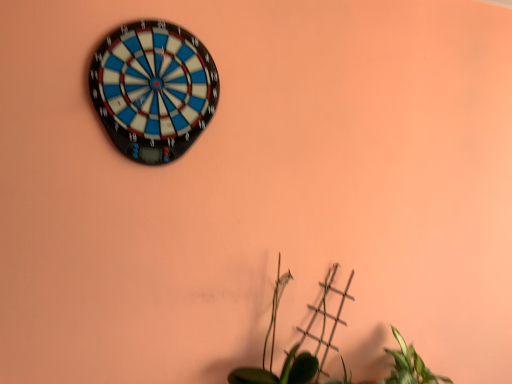
Describe the element at coordinates (153, 89) in the screenshot. I see `blue plastic dartboard at upper left` at that location.

The height and width of the screenshot is (384, 512). Identify the location of blue plastic dartboard at upper left. (153, 89).

The image size is (512, 384). Find the location of `green matte plant at lower center`. green matte plant at lower center is located at coordinates (298, 342).

Describe the element at coordinates (298, 342) in the screenshot. I see `green matte plant at lower center` at that location.

Measure the distance between green matte plant at lower center and camera.

1.32 meters.

The image size is (512, 384). Find the location of `blue plastic dartboard at upper left`. blue plastic dartboard at upper left is located at coordinates (153, 89).

Which object is positioned more to the left, green matte plant at lower center or blue plastic dartboard at upper left?

From the viewer's perspective, blue plastic dartboard at upper left appears more on the left side.

Considering the relative positions of green matte plant at lower center and blue plastic dartboard at upper left in the image provided, is green matte plant at lower center in front of blue plastic dartboard at upper left?

Yes, it is in front of blue plastic dartboard at upper left.

Considering the points (333, 335) and (169, 143), which point is in front, point (333, 335) or point (169, 143)?

Point (169, 143)

From the image's perspective, is green matte plant at lower center on top of blue plastic dartboard at upper left?

Incorrect, from the image's perspective, green matte plant at lower center is lower than blue plastic dartboard at upper left.

From a real-world perspective, relative to blue plastic dartboard at upper left, is green matte plant at lower center vertically above or below?

green matte plant at lower center is below blue plastic dartboard at upper left.

Which object is wider, green matte plant at lower center or blue plastic dartboard at upper left?

green matte plant at lower center is wider.

Considering the sizes of objects green matte plant at lower center and blue plastic dartboard at upper left in the image provided, who is taller, green matte plant at lower center or blue plastic dartboard at upper left?

Standing taller between the two is blue plastic dartboard at upper left.

Considering the sizes of objects green matte plant at lower center and blue plastic dartboard at upper left in the image provided, who is smaller, green matte plant at lower center or blue plastic dartboard at upper left?

Smaller between the two is blue plastic dartboard at upper left.

Choose the correct answer: Is green matte plant at lower center inside blue plastic dartboard at upper left or outside it?

green matte plant at lower center is not enclosed by blue plastic dartboard at upper left.

Is green matte plant at lower center not near blue plastic dartboard at upper left?

No, green matte plant at lower center is not far from blue plastic dartboard at upper left.

Is green matte plant at lower center turned away from blue plastic dartboard at upper left?

That's not correct — green matte plant at lower center is not looking away from blue plastic dartboard at upper left.

Can you tell me how much green matte plant at lower center and blue plastic dartboard at upper left differ in facing direction?

There is a 0.915-degree angle between the facing directions of green matte plant at lower center and blue plastic dartboard at upper left.

How distant is green matte plant at lower center from blue plastic dartboard at upper left?

78.91 centimeters.

Where is `houseplant in front of the blue plastic dartboard at upper left`? houseplant in front of the blue plastic dartboard at upper left is located at coordinates (298, 342).

Considering the positions of objects blue plastic dartboard at upper left and green matte plant at lower center in the image provided, who is more to the right, blue plastic dartboard at upper left or green matte plant at lower center?

green matte plant at lower center is more to the right.

Is the depth of blue plastic dartboard at upper left greater than that of green matte plant at lower center?

Yes, it is.

Considering the positions of point (204, 125) and point (297, 351), is point (204, 125) closer or farther from the camera than point (297, 351)?

Point (204, 125) is positioned closer to the camera compared to point (297, 351).

From the image's perspective, which object appears higher, blue plastic dartboard at upper left or green matte plant at lower center?

From the image's view, blue plastic dartboard at upper left is above.

From a real-world perspective, is blue plastic dartboard at upper left positioned above or below green matte plant at lower center?

In terms of real-world spatial position, blue plastic dartboard at upper left is above green matte plant at lower center.

Does blue plastic dartboard at upper left have a lesser width compared to green matte plant at lower center?

Indeed, blue plastic dartboard at upper left has a lesser width compared to green matte plant at lower center.

Considering the sizes of blue plastic dartboard at upper left and green matte plant at lower center in the image, is blue plastic dartboard at upper left taller or shorter than green matte plant at lower center?

blue plastic dartboard at upper left is taller than green matte plant at lower center.

Does blue plastic dartboard at upper left have a smaller size compared to green matte plant at lower center?

Correct, blue plastic dartboard at upper left occupies less space than green matte plant at lower center.

Could green matte plant at lower center be considered to be inside blue plastic dartboard at upper left?

That's incorrect, green matte plant at lower center is not inside blue plastic dartboard at upper left.

Are blue plastic dartboard at upper left and green matte plant at lower center making contact?

No, blue plastic dartboard at upper left is not making contact with green matte plant at lower center.

Is blue plastic dartboard at upper left facing towards green matte plant at lower center?

No, blue plastic dartboard at upper left is not oriented towards green matte plant at lower center.

Locate an element on the screen. Image resolution: width=512 pixels, height=384 pixels. houseplant located underneath the blue plastic dartboard at upper left (from a real-world perspective) is located at coordinates (298, 342).

Where is `wall clock behind the green matte plant at lower center`? Image resolution: width=512 pixels, height=384 pixels. wall clock behind the green matte plant at lower center is located at coordinates (153, 89).

In order to click on houseplant in front of the blue plastic dartboard at upper left in this screenshot , I will do `click(298, 342)`.